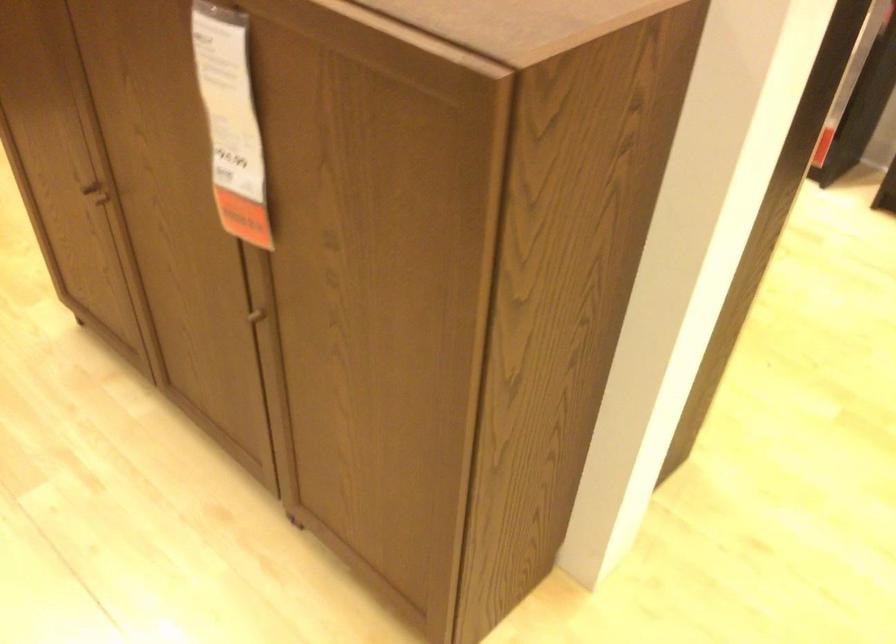
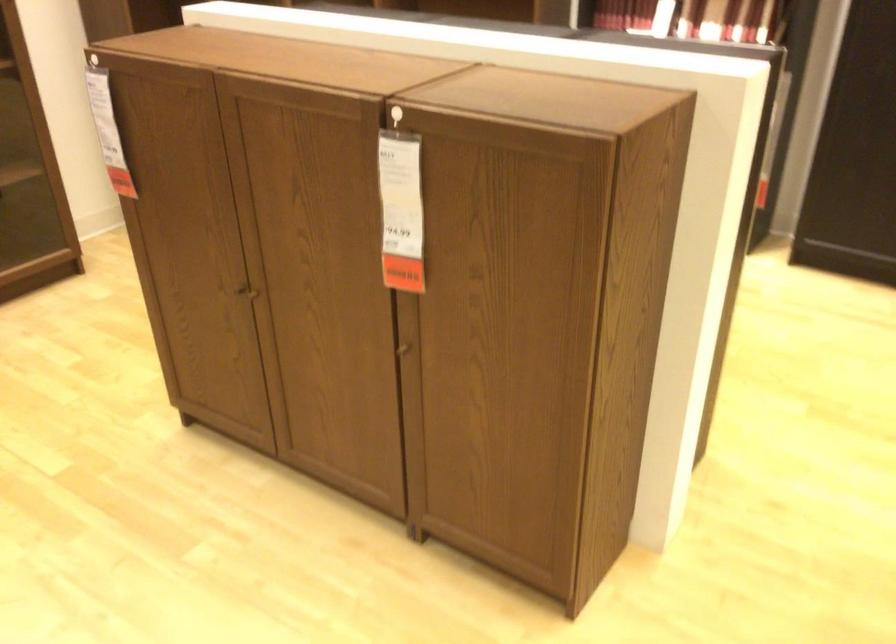
In a continuous first-person perspective shot, in which direction is the camera moving?

The cameraman walked toward left, backward.